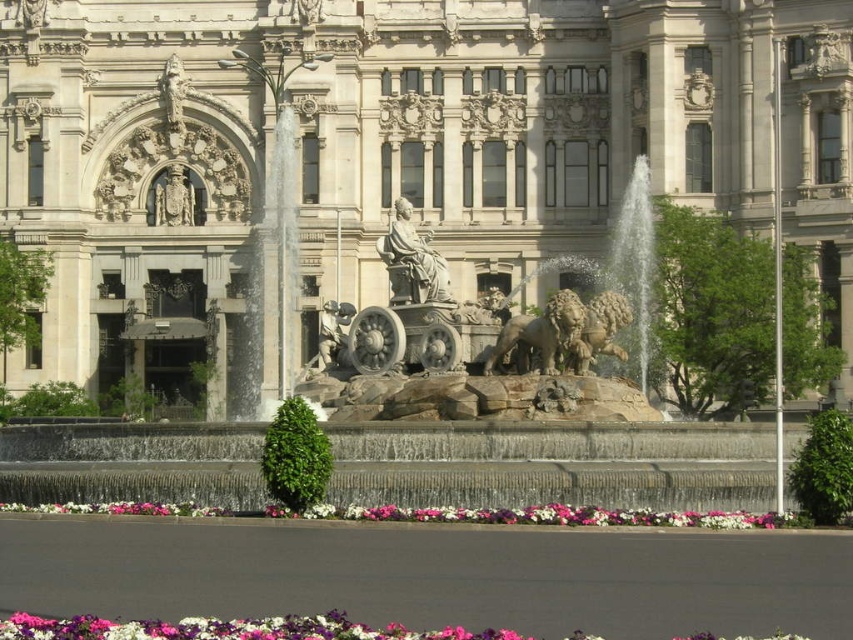
Is point (772, 515) closer to viewer compared to point (526, 368)?

Yes, it is.

Between point (618, 513) and point (573, 307), which one is positioned behind?

The point (573, 307) is more distant.

I want to click on pink-white floral border at center, so click(x=440, y=515).

Which is behind, point (567, 337) or point (169, 211)?

Point (169, 211)

Where is `stone lion at center`? stone lion at center is located at coordinates (563, 332).

Identify the location of stone lion at center. pyautogui.click(x=563, y=332).

Is point (659, 518) positioned in front of point (78, 621)?

No.

Between point (659, 513) and point (126, 628), which one is positioned behind?

The point (659, 513) is more distant.

Where is `pink-white floral border at center`? This screenshot has height=640, width=853. pink-white floral border at center is located at coordinates (440, 515).